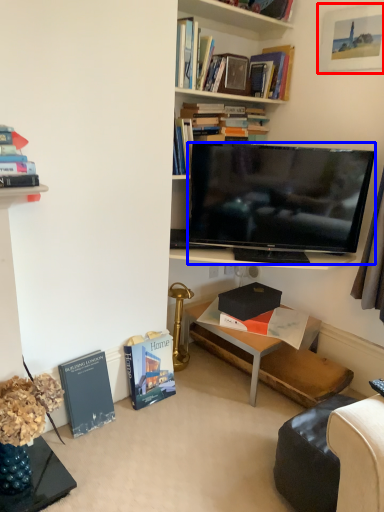
Question: Which of the following is the farthest to the observer, picture frame (highlighted by a red box) or television (highlighted by a blue box)?

Choices:
 (A) picture frame
 (B) television

Answer: (B)